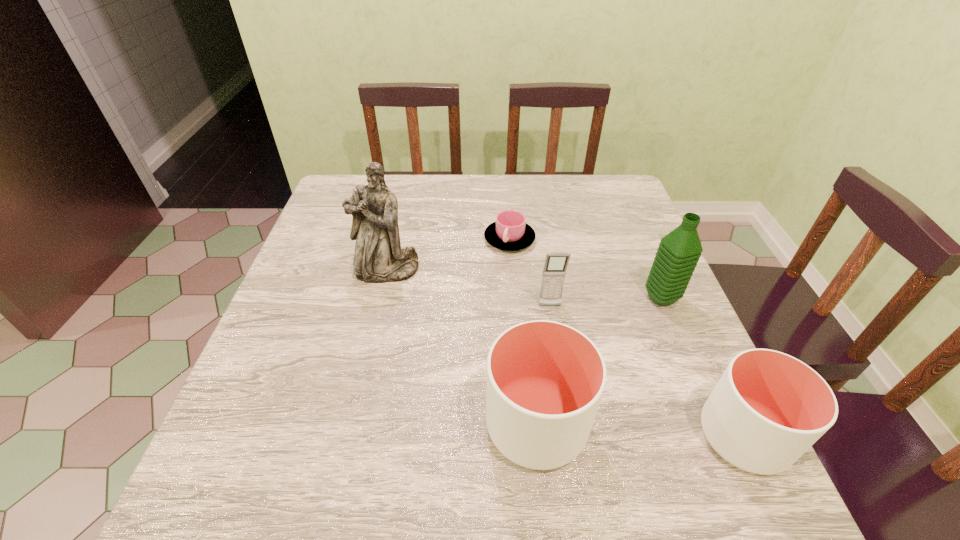
Find the location of `vacant region at the left edge of the desktop`. vacant region at the left edge of the desktop is located at coordinates (296, 393).

Identify the location of vacant area at the right edge. This screenshot has width=960, height=540. (634, 294).

The width and height of the screenshot is (960, 540). I want to click on vacant region at the far right corner of the desktop, so click(584, 186).

The image size is (960, 540). Find the location of `free space that is in between the cellular telephone and the water bottle`. free space that is in between the cellular telephone and the water bottle is located at coordinates (606, 302).

The height and width of the screenshot is (540, 960). What are the coordinates of `free spot between the shortest object and the cellular telephone` in the screenshot? It's located at (530, 273).

Where is `free space between the water bottle and the cellular telephone`? Image resolution: width=960 pixels, height=540 pixels. free space between the water bottle and the cellular telephone is located at coordinates (606, 302).

Find the location of a particular element. free space between the figurine and the cellular telephone is located at coordinates click(468, 288).

You are a GUI agent. You are given a task and a screenshot of the screen. Output one action in this format:
    pyautogui.click(x=<x>, y=<y>)
    Task: Click on the free area in between the rightmost cup and the cellular telephone
    The image size is (960, 540).
    Given the screenshot: What is the action you would take?
    pyautogui.click(x=647, y=371)

Identify which object is the fifth nearest to the tallest object. Please provide its 2D coordinates. Your answer should be formatted as a tuple, i.e. [(x, y)], where the tuple contains the x and y coordinates of a point satisfying the conditions above.

[(768, 408)]

Identify which object is the closest to the second shortest cup. Please provide its 2D coordinates. Your answer should be formatted as a tuple, i.e. [(x, y)], where the tuple contains the x and y coordinates of a point satisfying the conditions above.

[(545, 380)]